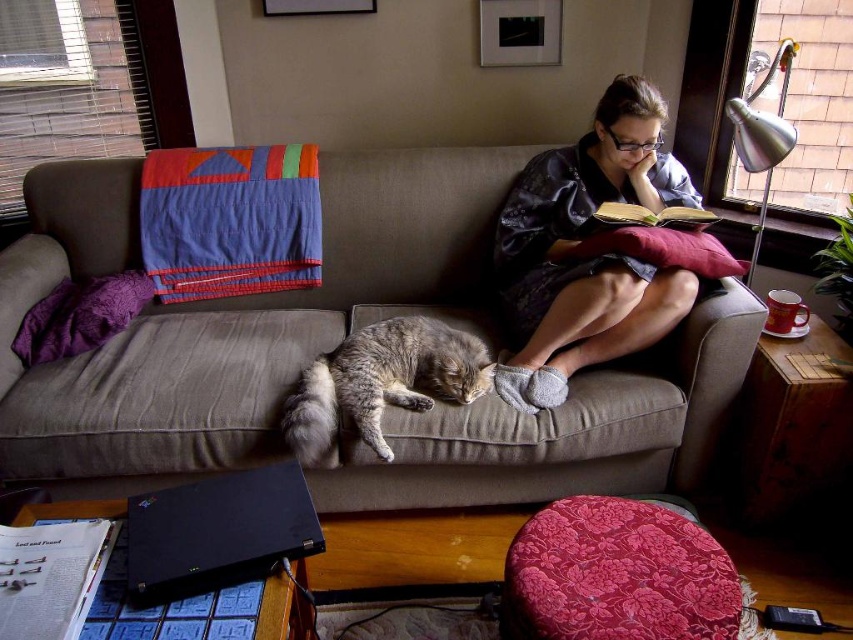
Question: Does matte gray robe at upper right appear under metallic silver lamp at upper right?

Choices:
 (A) yes
 (B) no

Answer: (A)

Question: Is matte gray robe at upper right to the right of gray striped fur cat at center from the viewer's perspective?

Choices:
 (A) no
 (B) yes

Answer: (B)

Question: Estimate the real-world distances between objects in this image. Which object is farther from the hardcover book at upper right?

Choices:
 (A) gray fabric couch at center
 (B) metallic silver lamp at upper right
 (C) velvet floral stool at lower center
 (D) matte gray robe at upper right

Answer: (C)

Question: Based on their relative distances, which object is farther from the matte gray robe at upper right?

Choices:
 (A) velvet floral stool at lower center
 (B) metallic silver lamp at upper right
 (C) gray fabric couch at center

Answer: (A)

Question: In this image, where is gray fabric couch at center located relative to hardcover book at upper right?

Choices:
 (A) right
 (B) left

Answer: (B)

Question: Based on their relative distances, which object is nearer to the gray fabric couch at center?

Choices:
 (A) hardcover book at upper right
 (B) gray striped fur cat at center
 (C) matte gray robe at upper right

Answer: (B)